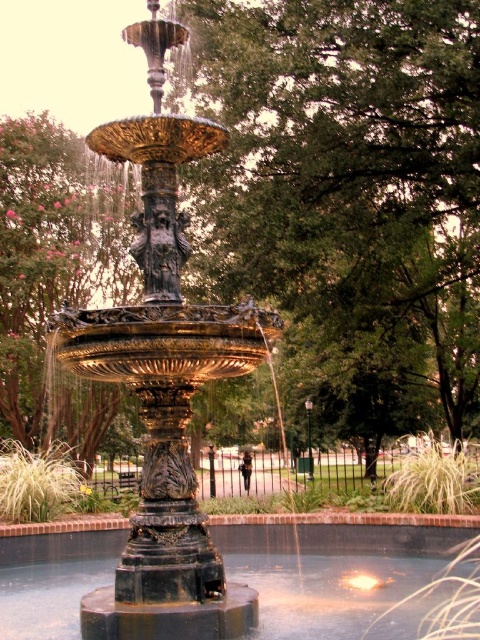
Does gold polished fountain at center come in front of black polished stone pool at center?

No, it is not.

Does point (158, 436) come closer to viewer compared to point (257, 563)?

Yes, it is in front of point (257, 563).

Is point (181, 355) positioned before point (68, 570)?

Yes.

Locate an element on the screen. gold polished fountain at center is located at coordinates (164, 380).

Does point (363, 65) lie in front of point (36, 269)?

That is True.

Is green leafy tree at center taller than green leafy tree at left?

Correct, green leafy tree at center is much taller as green leafy tree at left.

Is point (259, 209) farther from viewer compared to point (99, 284)?

No.

This screenshot has height=640, width=480. In order to click on green leafy tree at center in this screenshot , I will do `click(348, 195)`.

Can you confirm if black polished stone pool at center is positioned below green leafy tree at left?

Indeed, black polished stone pool at center is positioned under green leafy tree at left.

Does black polished stone pool at center lie in front of green leafy tree at left?

Yes, it is in front of green leafy tree at left.

Who is more forward, [417,556] or [38,243]?

Positioned in front is point [417,556].

Find the location of a particular element. black polished stone pool at center is located at coordinates (332, 564).